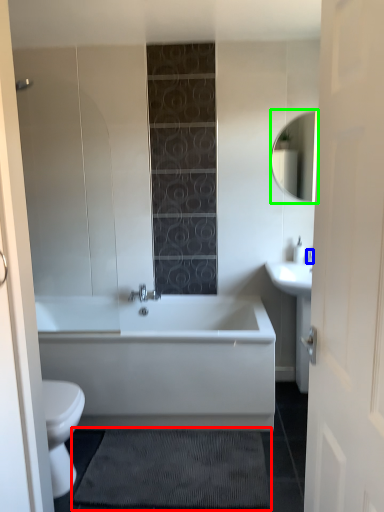
Question: Considering the real-world distances, which object is farthest from bath mat (highlighted by a red box)? faucet (highlighted by a blue box) or mirror (highlighted by a green box)?

Choices:
 (A) faucet
 (B) mirror

Answer: (B)